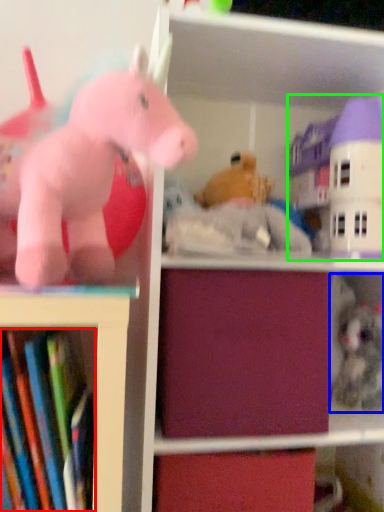
Question: Which object is positioned farthest from book (highlighted by a red box)? Select from toy (highlighted by a blue box) and toy (highlighted by a green box).

Choices:
 (A) toy
 (B) toy

Answer: (B)